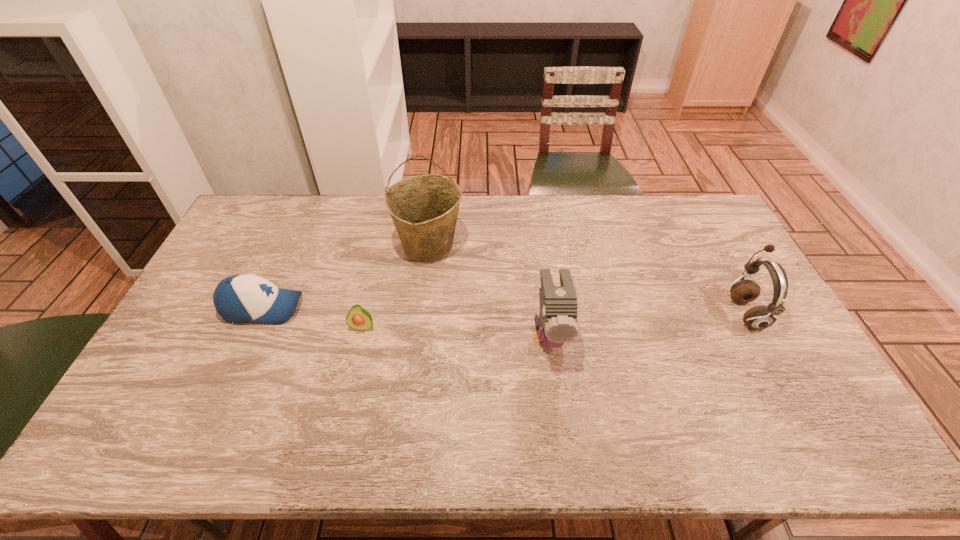
Identify the location of vacant region located 0.190m at the beak of the bird. (564, 438).

Where is `vacant space located on the front-facing side of the leftmost object`? The width and height of the screenshot is (960, 540). vacant space located on the front-facing side of the leftmost object is located at coordinates (421, 308).

Where is `vacant space located on the cut side of the avocado`? The width and height of the screenshot is (960, 540). vacant space located on the cut side of the avocado is located at coordinates (342, 415).

Identify the location of object that is at the far edge. (424, 208).

The width and height of the screenshot is (960, 540). I want to click on object that is positioned at the left edge, so click(241, 298).

The width and height of the screenshot is (960, 540). I want to click on object present at the right edge, so click(760, 317).

This screenshot has height=540, width=960. What are the coordinates of `blank space at the far edge of the desktop` in the screenshot? It's located at (655, 197).

Find the location of a particular element. The image size is (960, 540). vacant space at the near edge is located at coordinates (337, 455).

Find the location of a particular element. vacant region at the right edge of the desktop is located at coordinates (761, 295).

Identify the location of vacant region at the far right corner of the desktop. The height and width of the screenshot is (540, 960). (729, 234).